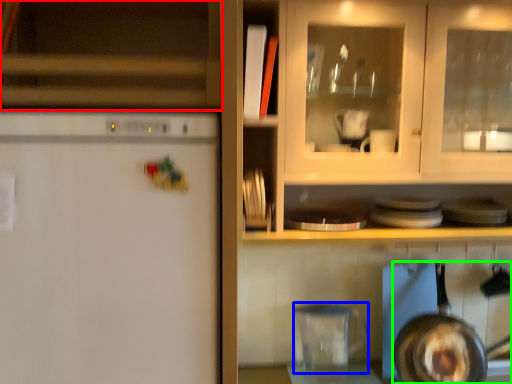
Question: Based on their relative distances, which object is nearer to cabinetry (highlighted by a red box)? Choose from appliance (highlighted by a blue box) and frying pan (highlighted by a green box).

Choices:
 (A) appliance
 (B) frying pan

Answer: (A)